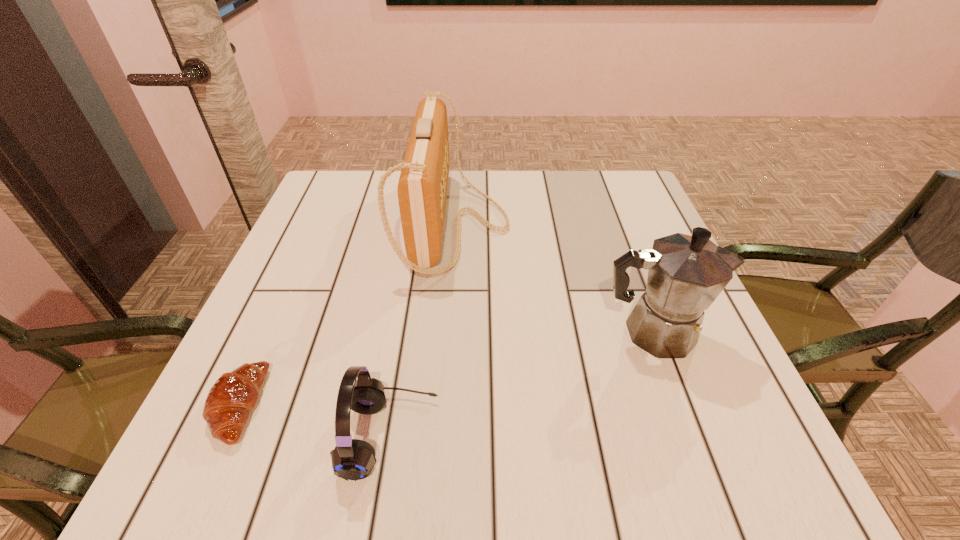
The width and height of the screenshot is (960, 540). Identify the location of vacant space at the far right corner. (627, 206).

Locate an element on the screen. This screenshot has width=960, height=540. vacant region between the headset and the third nearest object is located at coordinates (521, 384).

Find the location of a particular element. This screenshot has height=540, width=960. vacant area that lies between the rightmost object and the second shortest object is located at coordinates (521, 384).

Where is `vacant space that is in between the second shortest object and the handbag`? This screenshot has width=960, height=540. vacant space that is in between the second shortest object and the handbag is located at coordinates (422, 330).

The width and height of the screenshot is (960, 540). I want to click on blank region between the headset and the rightmost object, so click(521, 384).

The height and width of the screenshot is (540, 960). Identify the location of empty location between the leftmost object and the third nearest object. (445, 369).

At what (x,y) coordinates should I click in order to perform the action: click on unoccupied area between the leftmost object and the handbag. Please return your answer as a coordinate pair (x, y). The image size is (960, 540). Looking at the image, I should click on (347, 314).

What are the coordinates of `vacant region between the leftmost object and the headset` in the screenshot? It's located at (314, 421).

The height and width of the screenshot is (540, 960). Identify the location of free space that is in between the farthest object and the coffeepot. (554, 278).

The width and height of the screenshot is (960, 540). I want to click on free area in between the handbag and the headset, so click(422, 330).